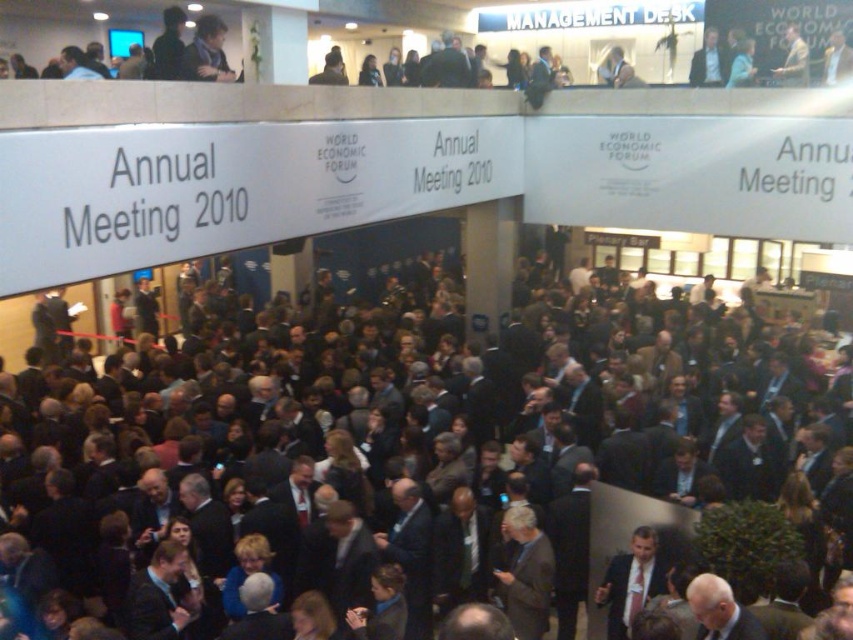
You are attending the World Economic Forum Annual Meeting 2010 and want to approach the person in the dark gray suit at upper center and the light beige suit at upper right. Which person should you walk towards first to reach them in the shortest path?

You should walk towards the dark gray suit at upper center first because it is closer to you than the light beige suit at upper right, so it requires a shorter path.

You are a photographer at the World Economic Forum Annual Meeting 2010. You need to capture a photo that includes both the dark suit crowd at center and the light beige suit at upper right. Considering their heights, which one should be placed lower in the photo to ensure both are visible?

The dark suit crowd at center is taller than the light beige suit at upper right. To ensure both are visible in the photo, the taller dark suit crowd at center should be placed lower in the photo so that the shorter light beige suit at upper right can be seen above it without obstruction.